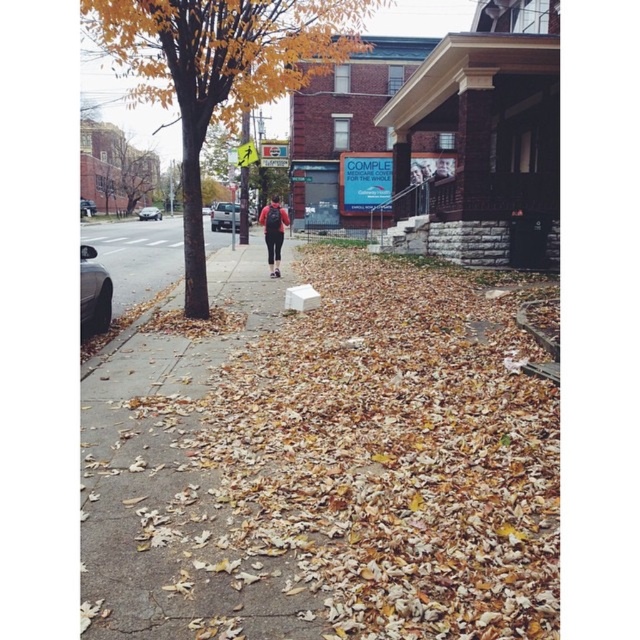
Question: Which point is farther to the camera?

Choices:
 (A) yellow leafy tree at center
 (B) matte black backpack at center

Answer: (B)

Question: Can you confirm if yellow leafy tree at center is positioned below matte black backpack at center?

Choices:
 (A) no
 (B) yes

Answer: (A)

Question: Is yellow leafy tree at center below matte black backpack at center?

Choices:
 (A) no
 (B) yes

Answer: (A)

Question: Which point is farther to the camera?

Choices:
 (A) (326, 3)
 (B) (280, 216)

Answer: (B)

Question: Can you confirm if yellow leafy tree at center is smaller than matte black backpack at center?

Choices:
 (A) yes
 (B) no

Answer: (B)